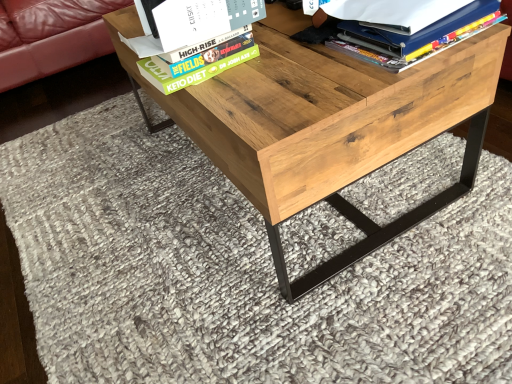
The height and width of the screenshot is (384, 512). I want to click on vacant space to the left of matte blue folder at upper right, so click(282, 80).